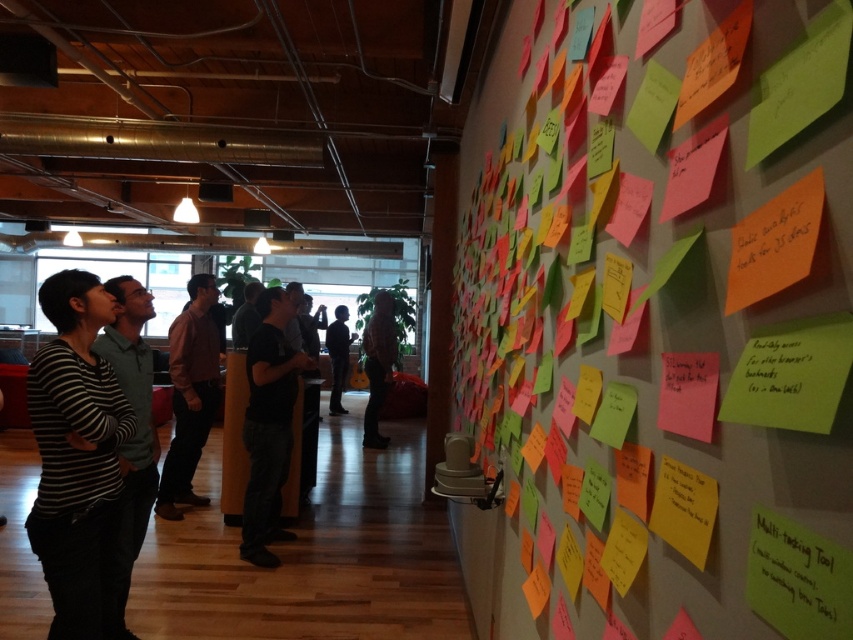
You are organizing a clothing donation drive and need to decide which items can fit into a small donation box. You see a striped cotton shirt at left and a matte orange sticky note at upper right. Which item is larger and would take up more space in the box?

The striped cotton shirt at left is bigger than the matte orange sticky note at upper right, so it would take up more space in the box.

You are organizing a clothing donation drive and need to arrange items from left to right. You have a striped cotton shirt at left and dark gray pants at center. Based on their positions in the image, which item should you place first when arranging from left to right?

The striped cotton shirt at left should be placed first since it is positioned to the left of the dark gray pants at center in the image.

You are standing in the workspace and want to reach both the matte black sticky notes at upper right and the dark gray pants at center. Which object is closer to you?

The matte black sticky notes at upper right are closer to the viewer than the dark gray pants at center.